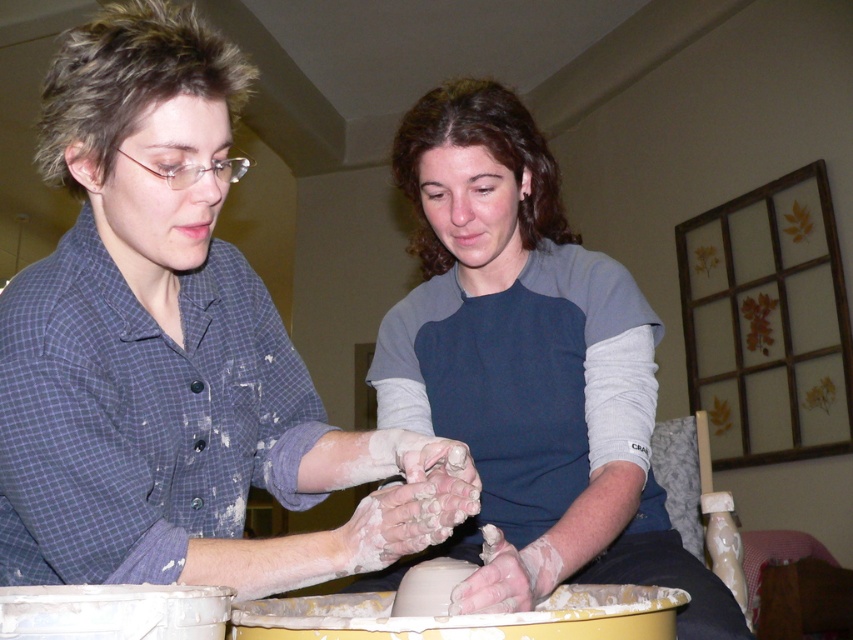
Is matte gray shirt at center smaller than blue fabric shirt at center?

Yes.

Is point (207, 317) closer to camera compared to point (456, 269)?

Yes, point (207, 317) is in front of point (456, 269).

Between point (274, 348) and point (616, 448), which one is positioned behind?

Point (616, 448)

Image resolution: width=853 pixels, height=640 pixels. I want to click on matte gray shirt at center, so click(175, 352).